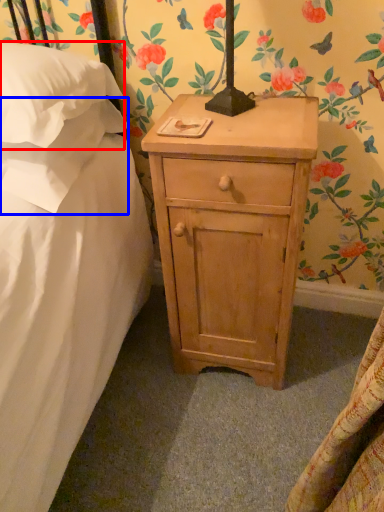
Question: Which object appears closest to the camera in this image, pillow (highlighted by a red box) or pillow (highlighted by a blue box)?

Choices:
 (A) pillow
 (B) pillow

Answer: (A)